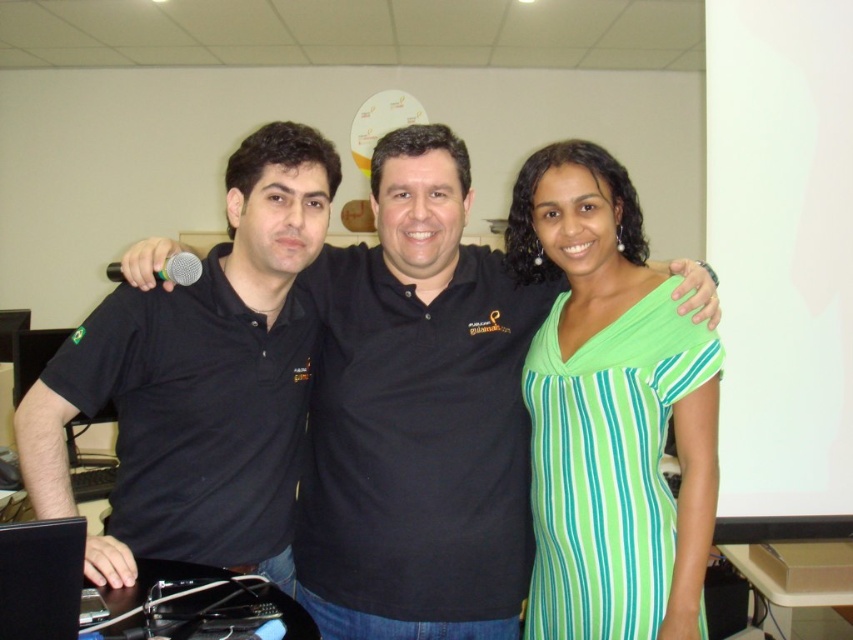
Question: Which point is closer to the camera?

Choices:
 (A) (212, 394)
 (B) (67, 616)

Answer: (B)

Question: Does black matte shirt at left lie in front of black glossy laptop at lower left?

Choices:
 (A) yes
 (B) no

Answer: (B)

Question: Can you confirm if black cotton polo shirt at center is positioned above green striped dress at center?

Choices:
 (A) no
 (B) yes

Answer: (A)

Question: Which of the following is the farthest from the observer?

Choices:
 (A) green striped dress at center
 (B) black glossy laptop at lower left
 (C) black cotton polo shirt at center
 (D) black matte shirt at left

Answer: (C)

Question: Which point is farther to the camera?

Choices:
 (A) black cotton polo shirt at center
 (B) black matte shirt at left
 (C) black glossy laptop at lower left

Answer: (A)

Question: Does green striped dress at center appear on the right side of black glossy laptop at lower left?

Choices:
 (A) no
 (B) yes

Answer: (B)